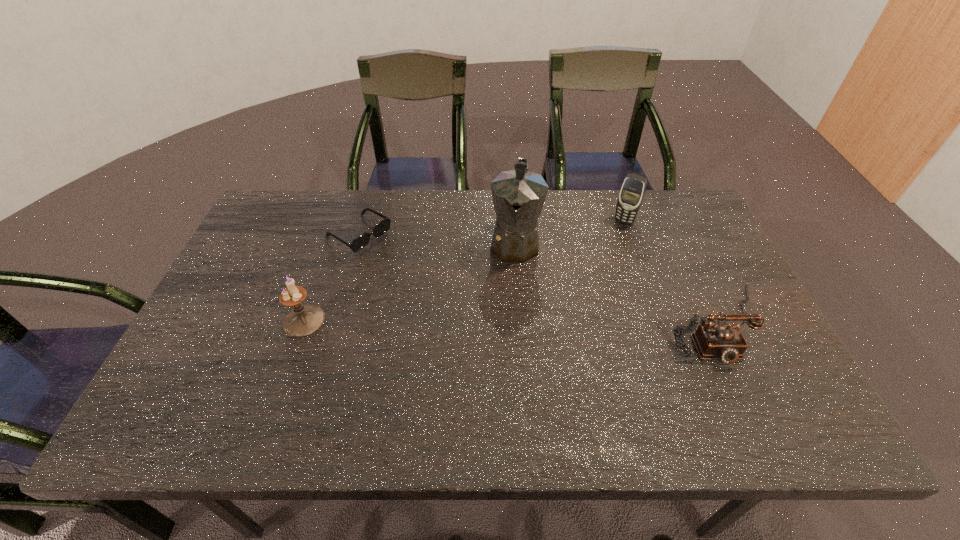
This screenshot has width=960, height=540. In order to click on vacant space that satisfies the following two spatial constraints: 1. on the back side of the third object from right to left; 2. on the left side of the cellular telephone in this screenshot , I will do `click(513, 221)`.

The height and width of the screenshot is (540, 960). I want to click on free location that satisfies the following two spatial constraints: 1. on the back side of the coffeepot; 2. on the left side of the cellular telephone, so click(513, 221).